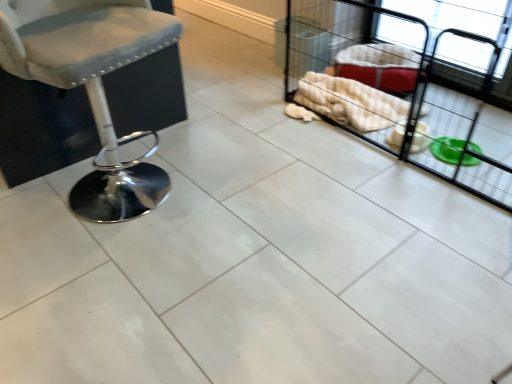
Where is `free space in front of matte gray fabric stool at left`? free space in front of matte gray fabric stool at left is located at coordinates (99, 262).